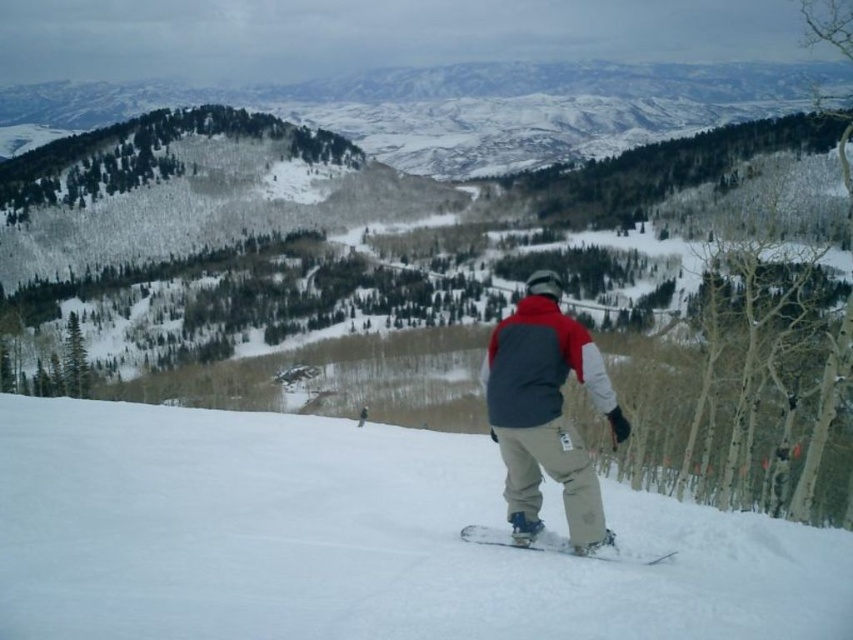
You are a photographer planning to take a photo of the gray fleece jacket at center and the white matte snowboard at center in the snowy mountain scene. Based on their sizes, which object should you focus on first to ensure both are in frame?

The gray fleece jacket at center has a greater height compared to the white matte snowboard at center, so you should focus on the gray fleece jacket at center first to ensure both are in frame.